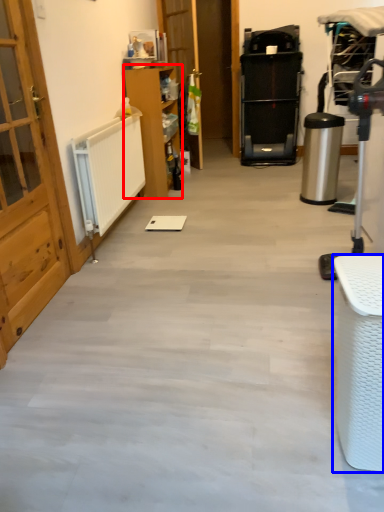
Question: Among these objects, which one is nearest to the camera, furniture (highlighted by a red box) or furniture (highlighted by a blue box)?

Choices:
 (A) furniture
 (B) furniture

Answer: (B)